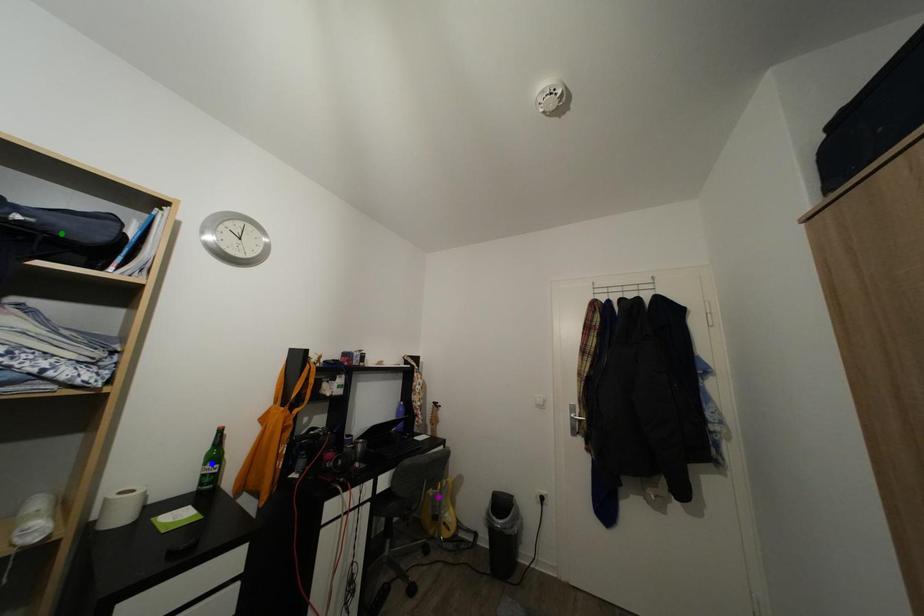
Order these from nearest to farthest:
1. green point
2. purple point
3. blue point

purple point
blue point
green point